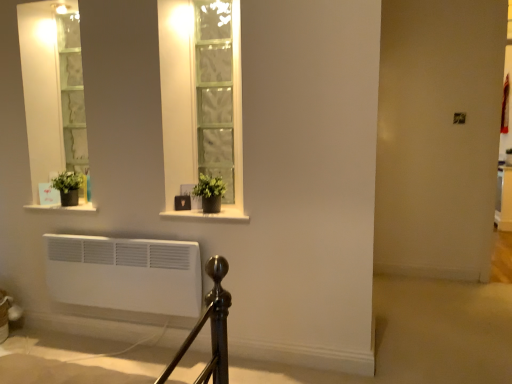
Question: Does matte black pot at lower left, placed as the 2th window sill when sorted from right to left, have a lesser height compared to matte black pot at center, the 2th window sill positioned from the left?

Choices:
 (A) yes
 (B) no

Answer: (B)

Question: Is matte black pot at lower left, placed as the 2th window sill when sorted from right to left, touching matte black pot at center, the 2th window sill positioned from the left?

Choices:
 (A) yes
 (B) no

Answer: (B)

Question: From the image's perspective, is matte black pot at lower left, which is the first window sill from left to right, over matte black pot at center, the 2th window sill positioned from the left?

Choices:
 (A) yes
 (B) no

Answer: (A)

Question: Considering the relative sizes of matte black pot at lower left, which is the first window sill from left to right, and matte black pot at center, which appears as the first window sill when viewed from the right, in the image provided, is matte black pot at lower left, which is the first window sill from left to right, taller than matte black pot at center, which appears as the first window sill when viewed from the right,?

Choices:
 (A) no
 (B) yes

Answer: (B)

Question: From a real-world perspective, is matte black pot at lower left, which is the first window sill from left to right, on top of matte black pot at center, which appears as the first window sill when viewed from the right?

Choices:
 (A) no
 (B) yes

Answer: (B)

Question: Would you say matte black pot at lower left, which is the first window sill from left to right, is outside matte black pot at center, which appears as the first window sill when viewed from the right?

Choices:
 (A) yes
 (B) no

Answer: (A)

Question: Is green matte plant at left, which appears as the 2th houseplant when viewed from the right, to the left of green matte plant at center, which is counted as the 1th houseplant, starting from the right, from the viewer's perspective?

Choices:
 (A) no
 (B) yes

Answer: (B)

Question: Is green matte plant at left, which appears as the second houseplant when viewed from the front, shorter than green matte plant at center, which is the 2th houseplant in left-to-right order?

Choices:
 (A) no
 (B) yes

Answer: (B)

Question: From the image's perspective, is green matte plant at left, which appears as the 2th houseplant when viewed from the right, located beneath green matte plant at center, which is counted as the 1th houseplant, starting from the right?

Choices:
 (A) no
 (B) yes

Answer: (A)

Question: Does green matte plant at left, which appears as the 1th houseplant when viewed from the left, have a greater height compared to green matte plant at center, which is the 2th houseplant in left-to-right order?

Choices:
 (A) no
 (B) yes

Answer: (A)

Question: Would you say green matte plant at left, which appears as the 1th houseplant when viewed from the left, is outside green matte plant at center, placed as the first houseplant when sorted from front to back?

Choices:
 (A) no
 (B) yes

Answer: (B)

Question: Is green matte plant at left, which appears as the 1th houseplant when viewed from the left, directly adjacent to green matte plant at center, the second houseplant in the back-to-front sequence?

Choices:
 (A) yes
 (B) no

Answer: (B)

Question: Is matte black pot at lower left, which is the first window sill from left to right, wider than green matte plant at center, which is the 2th houseplant in left-to-right order?

Choices:
 (A) no
 (B) yes

Answer: (B)